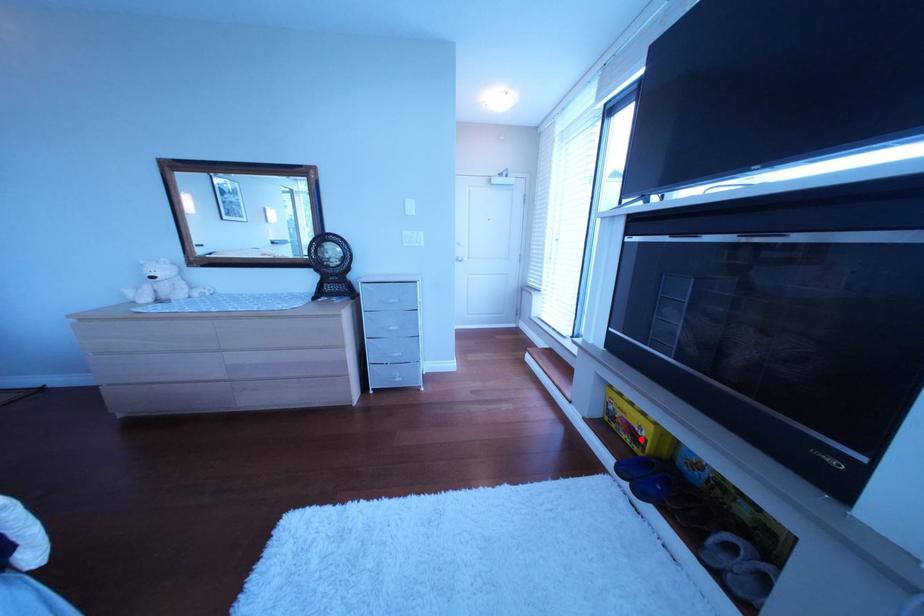
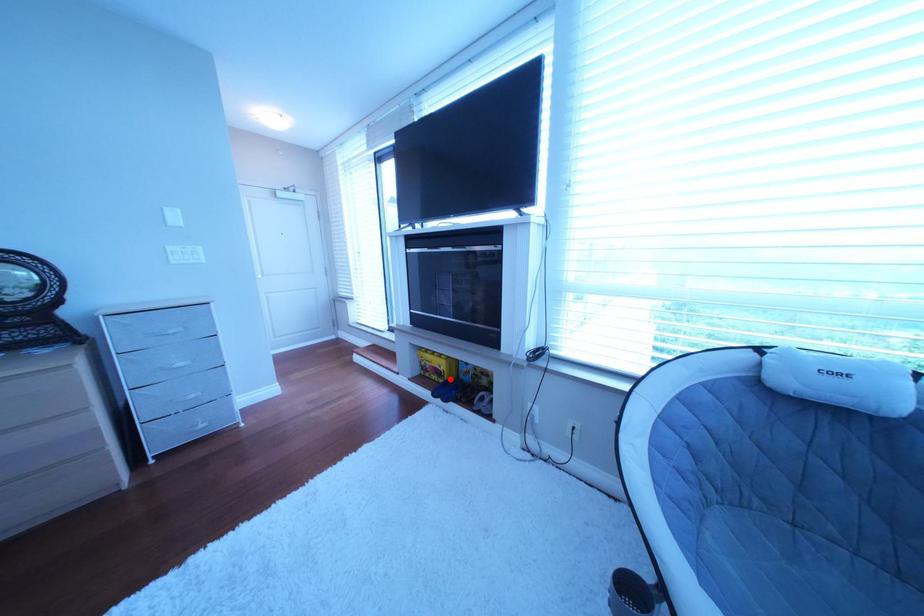
I am providing you with two images of the same scene from different viewpoints. A red point is marked on the first image and another point is marked on the second image. Does the point marked in image1 correspond to the same location as the one in image2?

Yes